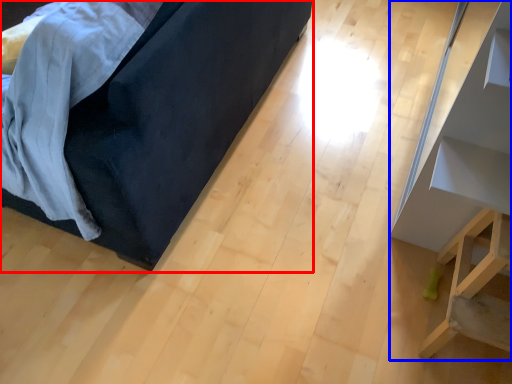
Question: Among these objects, which one is nearest to the camera, furniture (highlighted by a red box) or furniture (highlighted by a blue box)?

Choices:
 (A) furniture
 (B) furniture

Answer: (A)